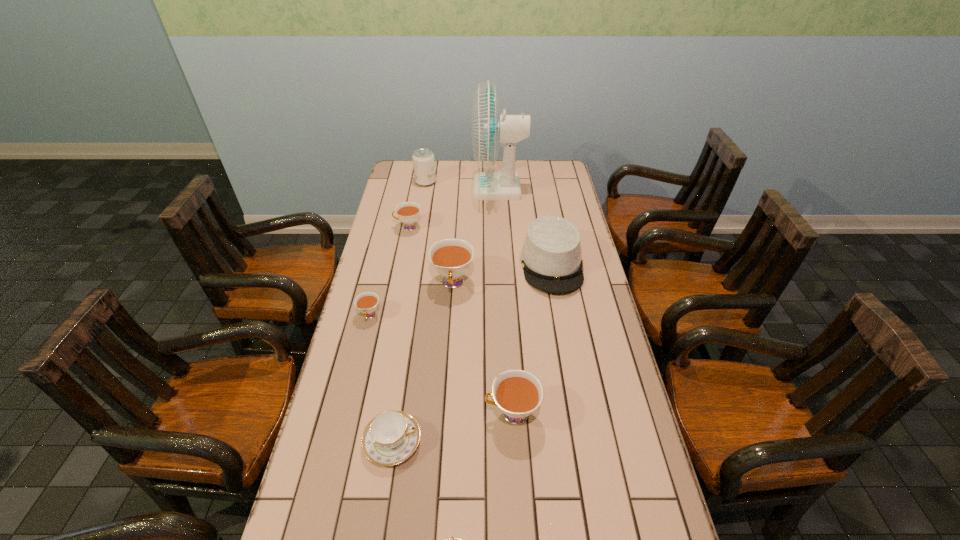
Image resolution: width=960 pixels, height=540 pixels. In order to click on free space at the far edge of the desktop in this screenshot , I will do `click(523, 161)`.

At what (x,y) coordinates should I click in order to perform the action: click on blank space at the left edge of the desktop. Please return your answer as a coordinate pair (x, y). Looking at the image, I should click on (346, 395).

The width and height of the screenshot is (960, 540). In order to click on vacant position at the right edge of the desktop in this screenshot , I will do `click(650, 523)`.

This screenshot has height=540, width=960. In order to click on free space at the far left corner of the desktop in this screenshot , I will do `click(397, 170)`.

The height and width of the screenshot is (540, 960). Find the location of `free space that is in between the soda can and the hat`. free space that is in between the soda can and the hat is located at coordinates (489, 223).

Find the location of `vacant space in between the soda can and the tallest teacup`. vacant space in between the soda can and the tallest teacup is located at coordinates (440, 233).

What are the coordinates of `free space between the soda can and the white fan` in the screenshot? It's located at (462, 185).

The width and height of the screenshot is (960, 540). What are the coordinates of `free space between the second smallest white teacup and the second tallest teacup` in the screenshot? It's located at (460, 320).

At what (x,y) coordinates should I click in order to perform the action: click on empty space that is in between the soda can and the hat. Please return your answer as a coordinate pair (x, y). The image size is (960, 540). Looking at the image, I should click on (489, 223).

What are the coordinates of `free space between the white fan and the soda can` in the screenshot? It's located at (462, 185).